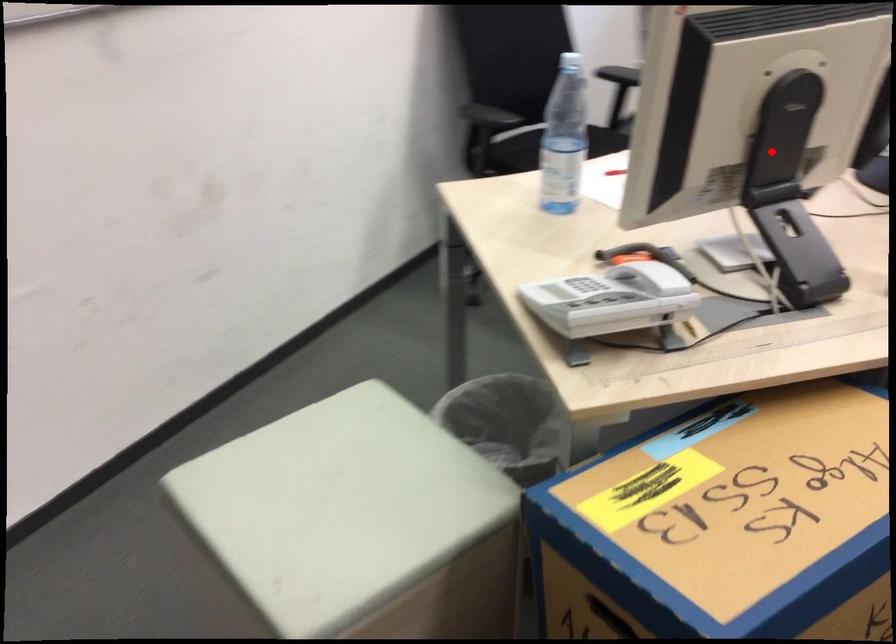
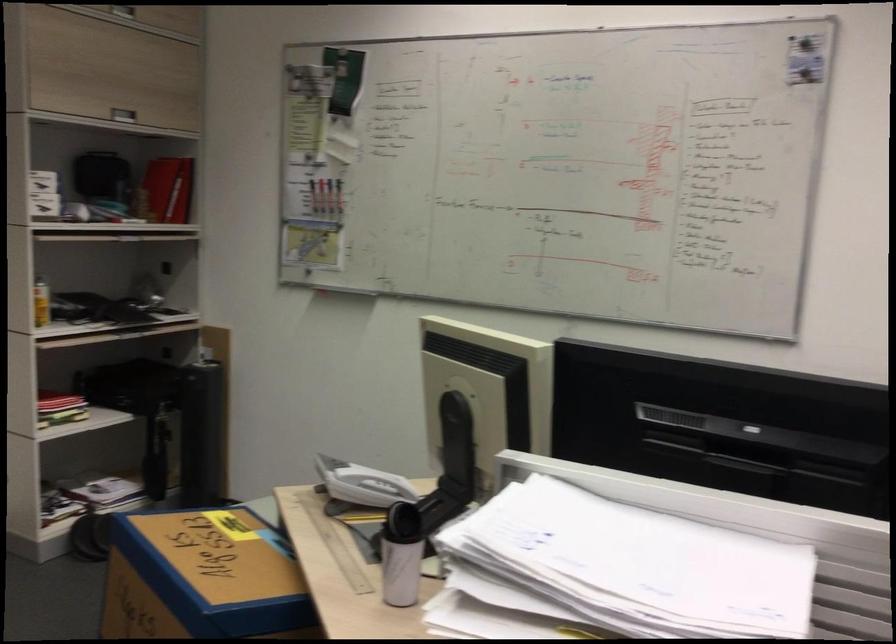
Question: I am providing you with two images of the same scene from different viewpoints. Image1 has a red point marked. In image2, the corresponding 3D location appears at what relative position? Reply with the corresponding letter.

Choices:
 (A) Closer
 (B) Farther

Answer: (B)